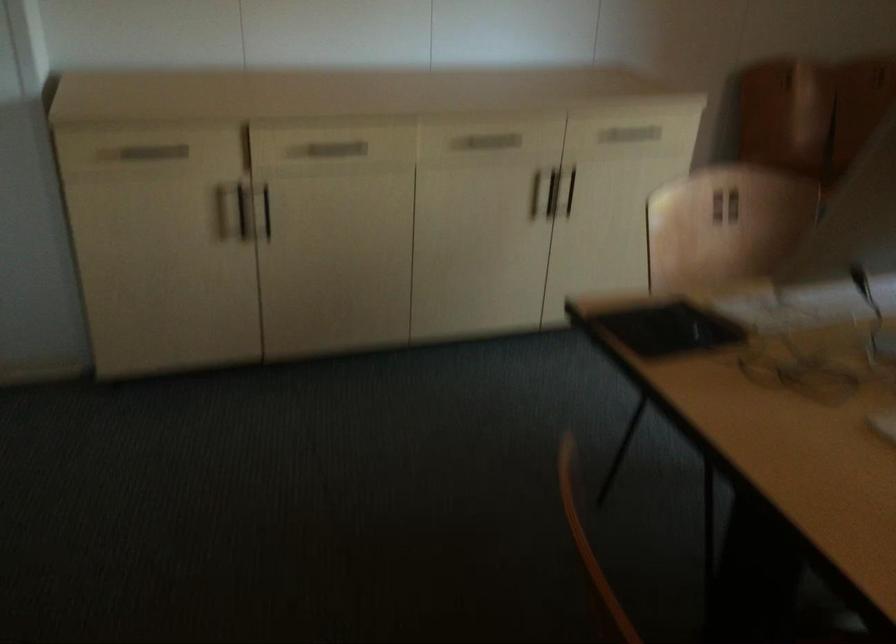
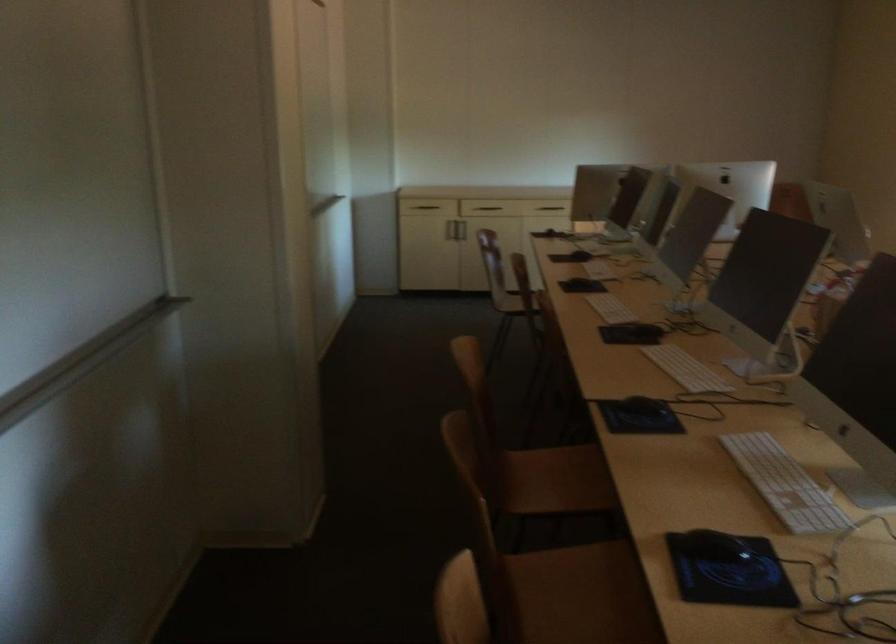
Question: I am providing you with two images of the same scene from different viewpoints. Please identify which objects are invisible in image2.

Choices:
 (A) wall-mounted handrail
 (B) black tablet
 (C) dark drawer handle
 (D) blue sofa seat

Answer: (B)